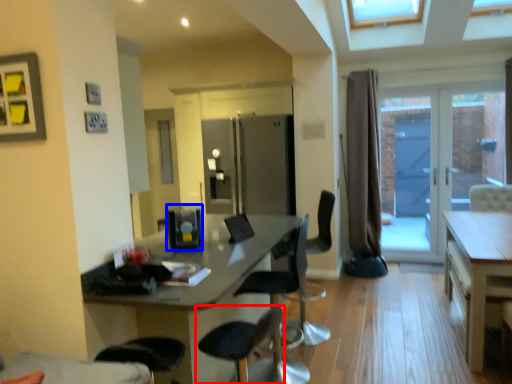
Question: Which of the following is the farthest to the observer, chair (highlighted by a red box) or appliance (highlighted by a blue box)?

Choices:
 (A) chair
 (B) appliance

Answer: (B)